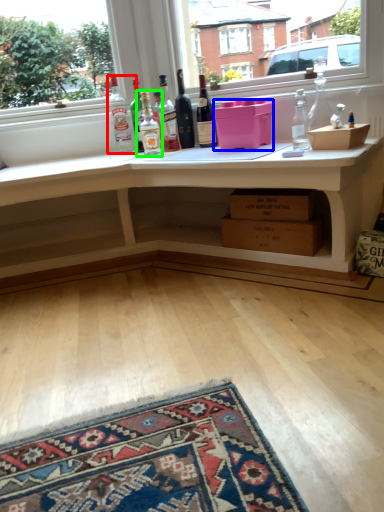
Question: Based on their relative distances, which object is farther from bottle (highlighted by a red box)? Choose from box (highlighted by a blue box) and bottle (highlighted by a green box).

Choices:
 (A) box
 (B) bottle

Answer: (A)